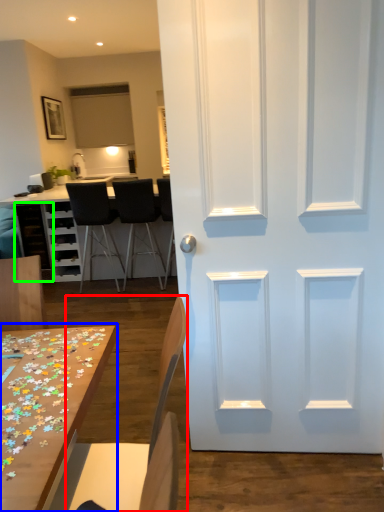
Question: Estimate the real-world distances between objects in this image. Which object is farther from chair (highlighted by a red box), table (highlighted by a blue box) or cabinetry (highlighted by a green box)?

Choices:
 (A) table
 (B) cabinetry

Answer: (B)